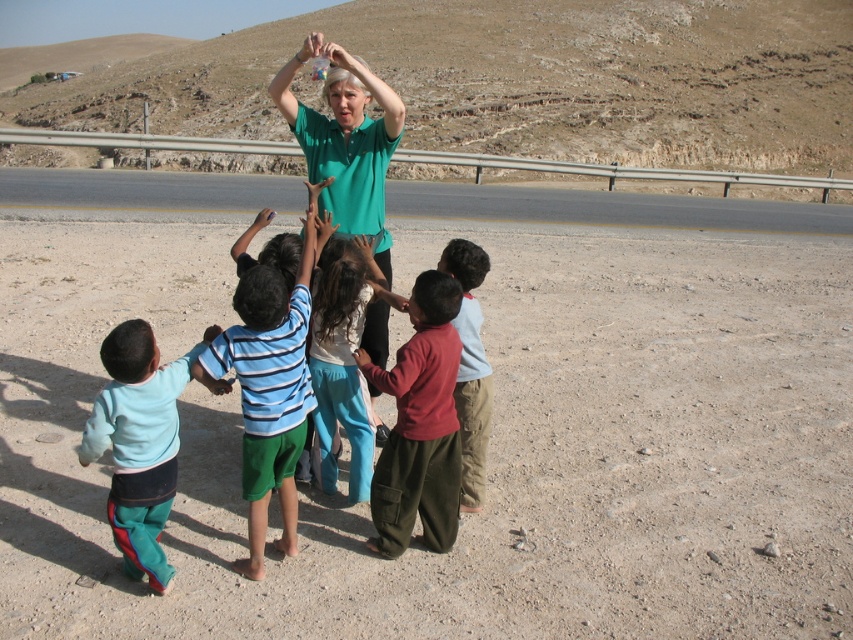
Where is `green matte shirt at upper center`? This screenshot has height=640, width=853. green matte shirt at upper center is located at coordinates (345, 140).

Does green matte shirt at upper center have a greater width compared to smooth skin hand at center?

Indeed, green matte shirt at upper center has a greater width compared to smooth skin hand at center.

What are the coordinates of `green matte shirt at upper center` in the screenshot? It's located at (345, 140).

In order to click on green matte shirt at upper center in this screenshot , I will do `click(345, 140)`.

Does blue striped shirt at center have a lesser height compared to green matte shirt at upper center?

Yes, blue striped shirt at center is shorter than green matte shirt at upper center.

Looking at this image, who is more distant from viewer, (265, 422) or (314, 161)?

Point (314, 161)

Locate an element on the screen. The image size is (853, 640). blue striped shirt at center is located at coordinates (267, 392).

Is blue striped shirt at center closer to camera compared to smooth blue shirt at lower left?

Yes, blue striped shirt at center is closer to the viewer.

Which is behind, point (281, 352) or point (209, 326)?

The point (209, 326) is more distant.

Image resolution: width=853 pixels, height=640 pixels. What do you see at coordinates (267, 392) in the screenshot?
I see `blue striped shirt at center` at bounding box center [267, 392].

Locate an element on the screen. blue striped shirt at center is located at coordinates (267, 392).